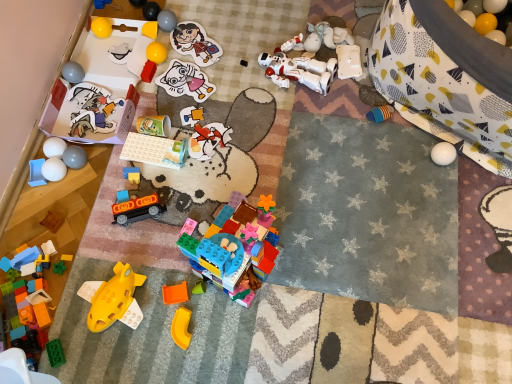
Where is `free space above matte cardboard cutout at upper left, positioned as the eleventh toy in left-to-right order (from a real-world perspective)`? The width and height of the screenshot is (512, 384). free space above matte cardboard cutout at upper left, positioned as the eleventh toy in left-to-right order (from a real-world perspective) is located at coordinates [x=90, y=110].